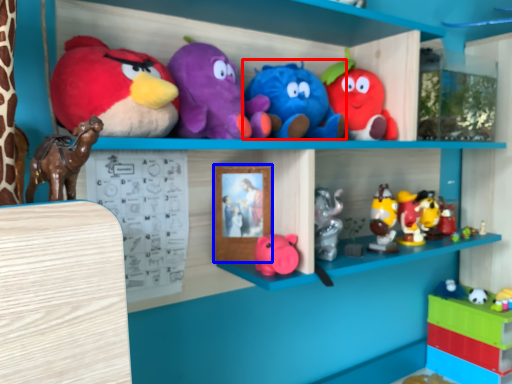
Question: Which point is closer to the camera, toy (highlighted by a red box) or picture frame (highlighted by a blue box)?

Choices:
 (A) toy
 (B) picture frame

Answer: (A)